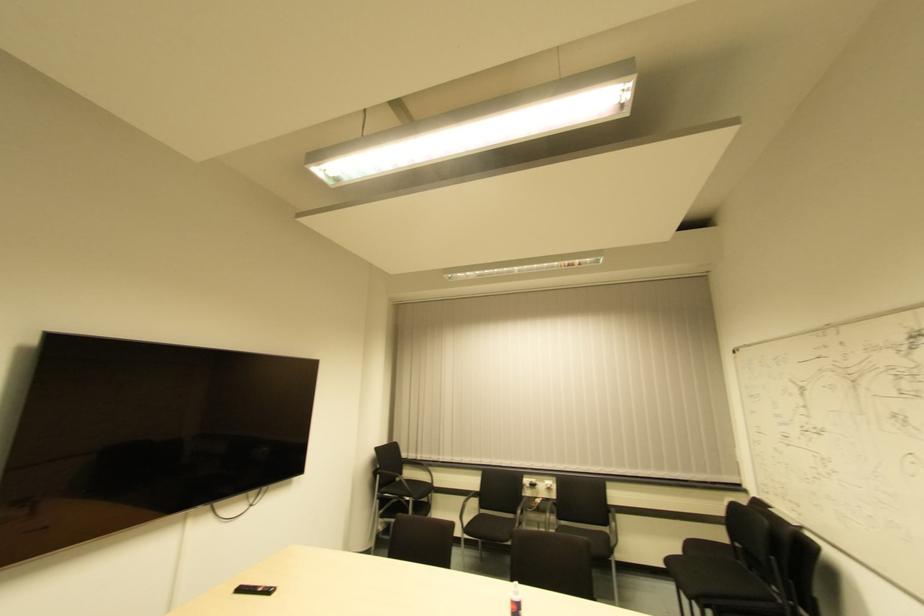
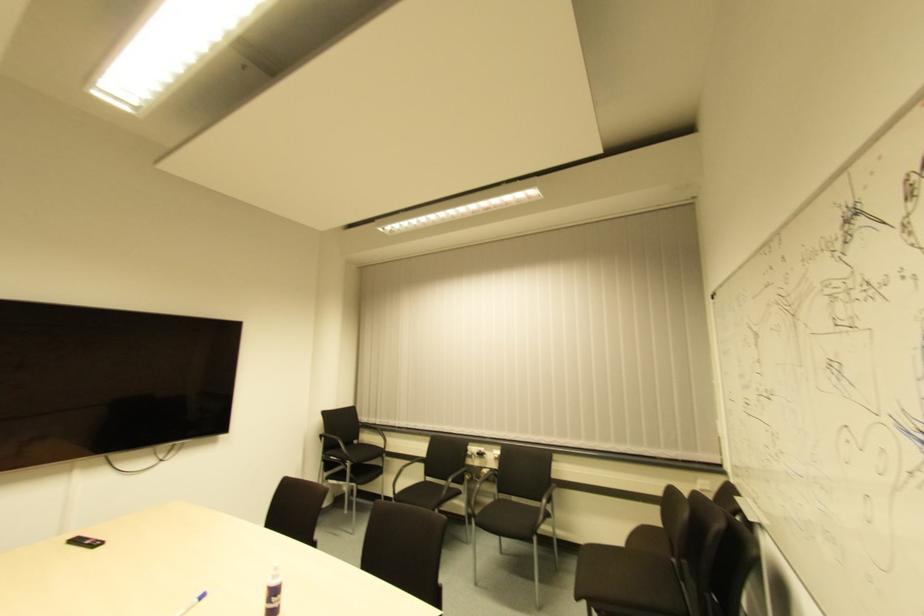
The point at (x=523, y=479) is marked in the first image. Where is the corresponding point in the second image?

(468, 447)